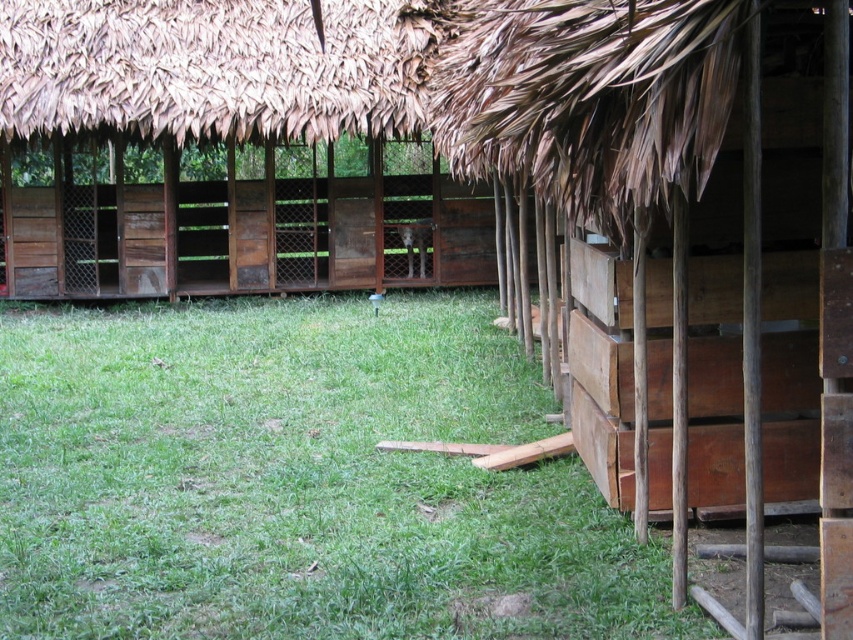
Between wooden crates at center and brown thatch roof at upper center, which one has less height?

brown thatch roof at upper center is shorter.

Which of these two, wooden crates at center or brown thatch roof at upper center, stands taller?

wooden crates at center is taller.

Between point (624, 74) and point (323, 6), which one is positioned behind?

Point (323, 6)

The image size is (853, 640). In order to click on wooden crates at center in this screenshot , I will do `click(680, 248)`.

Between green grass at center and brown thatch roof at upper center, which one has less height?

brown thatch roof at upper center is shorter.

Does green grass at center appear on the right side of brown thatch roof at upper center?

Yes, green grass at center is to the right of brown thatch roof at upper center.

Where is `green grass at center`? The width and height of the screenshot is (853, 640). green grass at center is located at coordinates (297, 481).

Identify the location of green grass at center. (297, 481).

Can you confirm if green grass at center is positioned above wooden crates at center?

No.

Where is `green grass at center`? This screenshot has height=640, width=853. green grass at center is located at coordinates (297, 481).

Describe the element at coordinates (297, 481) in the screenshot. Image resolution: width=853 pixels, height=640 pixels. I see `green grass at center` at that location.

The height and width of the screenshot is (640, 853). What are the coordinates of `green grass at center` in the screenshot? It's located at 297,481.